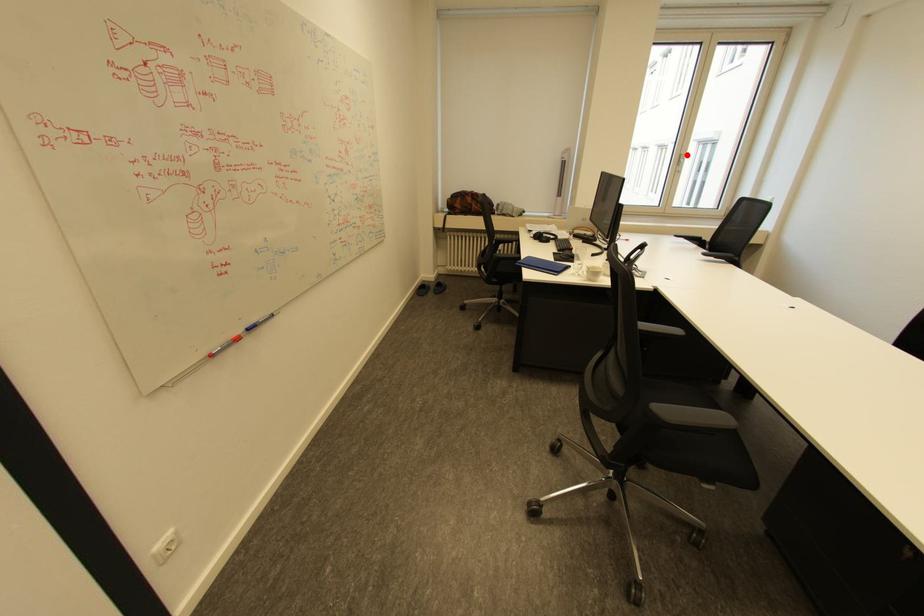
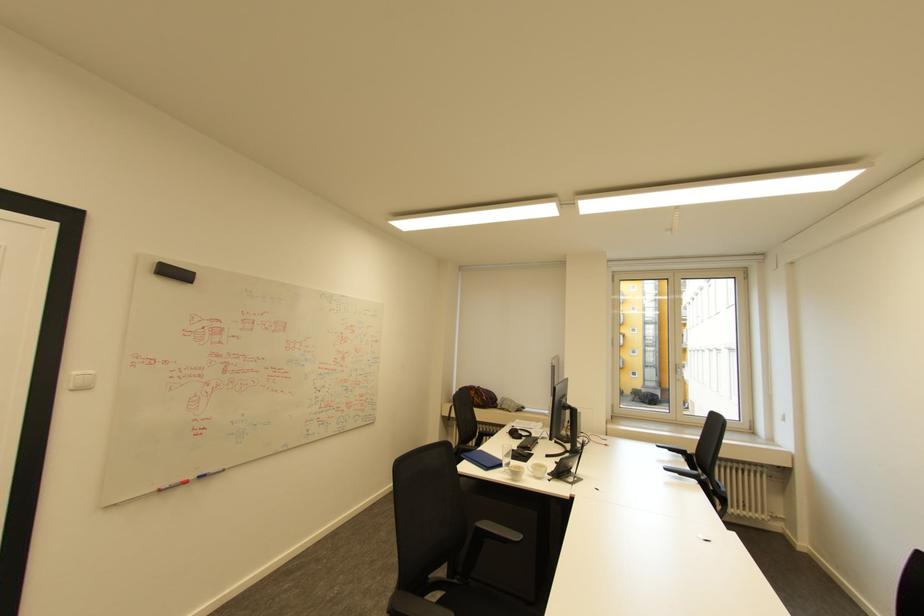
Locate, in the second image, the point that corresponds to the highlighted location in the first image.

(683, 365)